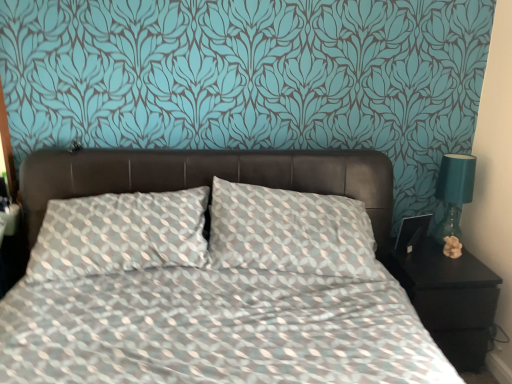
Question: Based on their positions, is matte beige figurine at right located to the left or right of teal glass lamp at right?

Choices:
 (A) right
 (B) left

Answer: (B)

Question: Considering the positions of matte beige figurine at right and teal glass lamp at right in the image, is matte beige figurine at right taller or shorter than teal glass lamp at right?

Choices:
 (A) tall
 (B) short

Answer: (B)

Question: Which object is positioned closest to the black glossy nightstand at lower right?

Choices:
 (A) teal glass lamp at right
 (B) matte beige figurine at right

Answer: (B)

Question: Estimate the real-world distances between objects in this image. Which object is closer to the matte beige figurine at right?

Choices:
 (A) black glossy nightstand at lower right
 (B) teal glass lamp at right

Answer: (B)